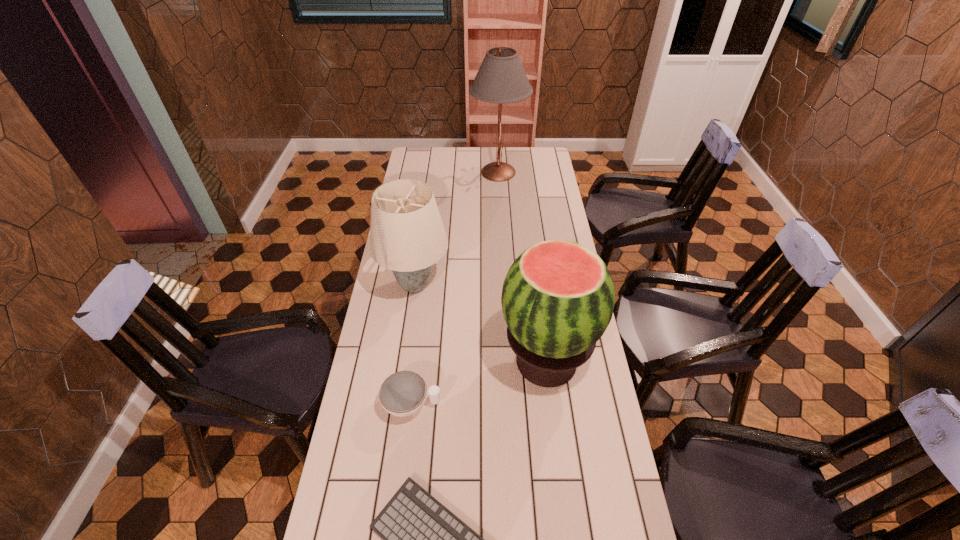
Image resolution: width=960 pixels, height=540 pixels. Identify the location of the tallest object. tap(501, 79).

Image resolution: width=960 pixels, height=540 pixels. I want to click on table lamp, so click(501, 79).

Find the location of a particular element. watermelon is located at coordinates (558, 298).

Locate an element on the screen. lampshade is located at coordinates (407, 235).

Identify the location of the second shortest object. Image resolution: width=960 pixels, height=540 pixels. (403, 393).

This screenshot has width=960, height=540. I want to click on free region located on the front-facing side of the table lamp, so click(410, 172).

The image size is (960, 540). Find the location of `vacant region located on the front-facing side of the table lamp`. vacant region located on the front-facing side of the table lamp is located at coordinates (443, 172).

Where is `vacant space located on the front-facing side of the table lamp`? This screenshot has width=960, height=540. vacant space located on the front-facing side of the table lamp is located at coordinates (414, 172).

This screenshot has height=540, width=960. I want to click on free spot located 0.210m on the front of the watermelon, so click(x=560, y=475).

At what (x,y) coordinates should I click in order to perform the action: click on vacant space located 0.070m on the back of the fourth nearest object. Please return your answer as a coordinate pair (x, y). The height and width of the screenshot is (540, 960). Looking at the image, I should click on coord(420,249).